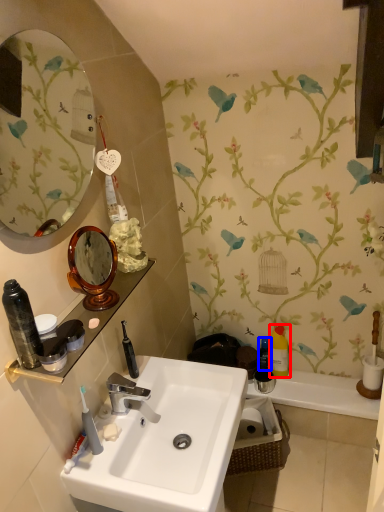
Question: Which object is closer to the camera taking this photo, toiletry (highlighted by a red box) or toiletry (highlighted by a blue box)?

Choices:
 (A) toiletry
 (B) toiletry

Answer: (A)